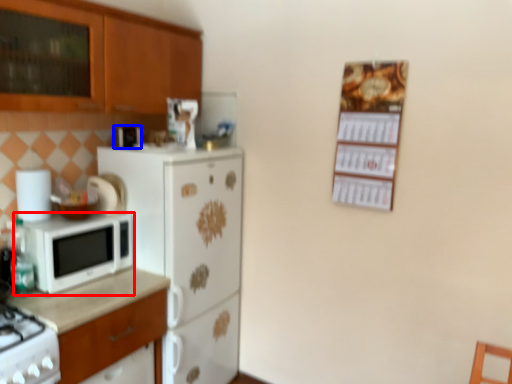
Question: Which object appears farthest to the camera in this image, microwave oven (highlighted by a red box) or appliance (highlighted by a blue box)?

Choices:
 (A) microwave oven
 (B) appliance

Answer: (B)